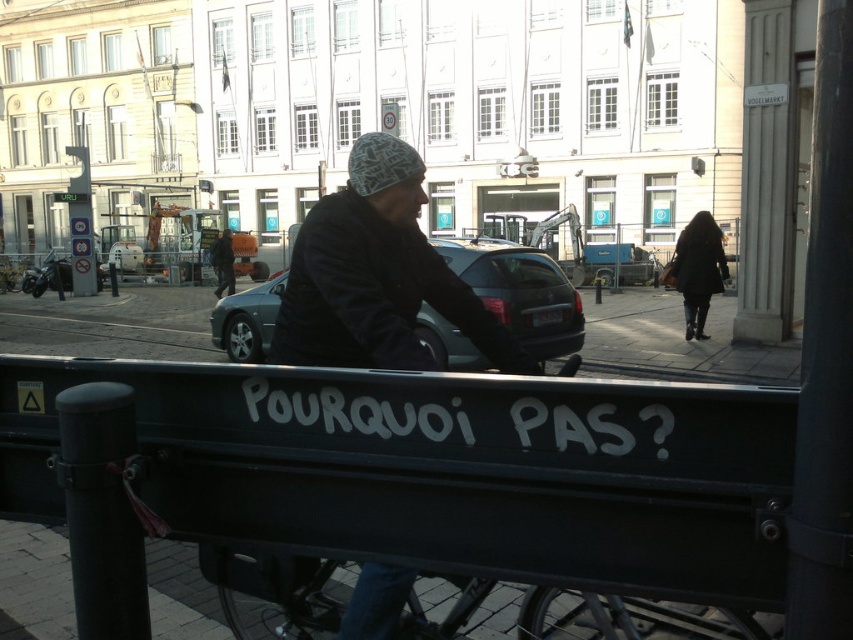
Question: Is black painted metal cart at lower center below black woolen hat at center?

Choices:
 (A) no
 (B) yes

Answer: (B)

Question: Among these objects, which one is farthest from the camera?

Choices:
 (A) black painted metal cart at lower center
 (B) dark gray knit cap at upper center
 (C) black woolen hat at center
 (D) dark brown coat at right

Answer: (B)

Question: Does shiny black car at center lie in front of dark gray knit cap at upper center?

Choices:
 (A) no
 (B) yes

Answer: (B)

Question: Can you confirm if black painted metal cart at lower center is thinner than dark gray knit cap at upper center?

Choices:
 (A) yes
 (B) no

Answer: (B)

Question: Which of these objects is positioned farthest from the dark brown coat at right?

Choices:
 (A) black woolen hat at center
 (B) black painted metal cart at lower center
 (C) dark gray knit cap at upper center
 (D) shiny black car at center

Answer: (C)

Question: Which point is closer to the camera?

Choices:
 (A) dark gray knit cap at upper center
 (B) black painted metal cart at lower center
 (C) black woolen hat at center
 (D) dark brown coat at right

Answer: (B)